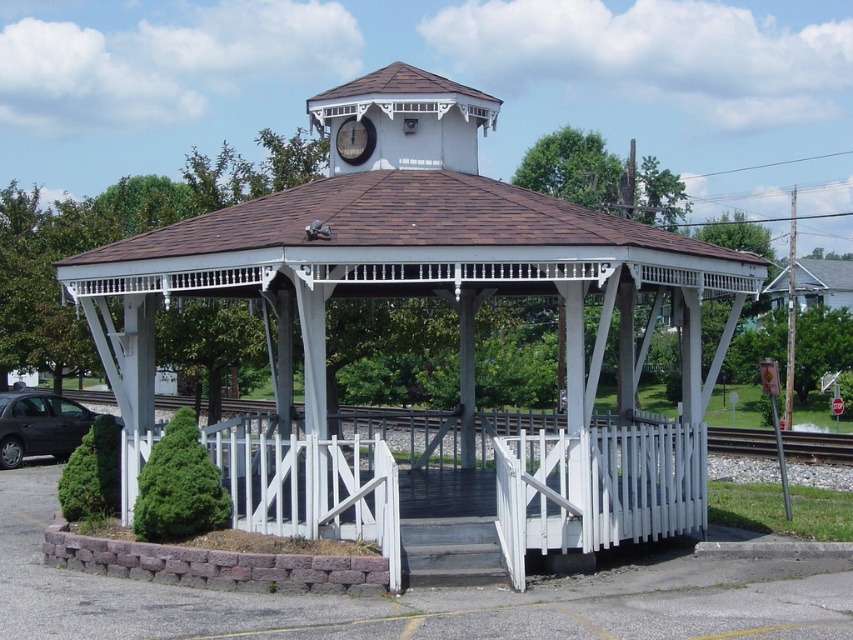
Question: Does white wooden train track at lower center have a smaller size compared to white wood clock at upper center?

Choices:
 (A) no
 (B) yes

Answer: (A)

Question: Is white wood clock at upper center positioned behind matte black car at lower left?

Choices:
 (A) no
 (B) yes

Answer: (A)

Question: Which of the following is the closest to the observer?

Choices:
 (A) white wood clock at upper center
 (B) white wooden train track at lower center
 (C) white wood gazebo at center

Answer: (C)

Question: Estimate the real-world distances between objects in this image. Which object is closer to the white wood clock at upper center?

Choices:
 (A) matte black car at lower left
 (B) white wooden train track at lower center
 (C) white wood gazebo at center

Answer: (C)

Question: Does white wood gazebo at center have a lesser width compared to white wooden train track at lower center?

Choices:
 (A) no
 (B) yes

Answer: (B)

Question: Among these objects, which one is nearest to the camera?

Choices:
 (A) matte black car at lower left
 (B) white wooden train track at lower center

Answer: (B)